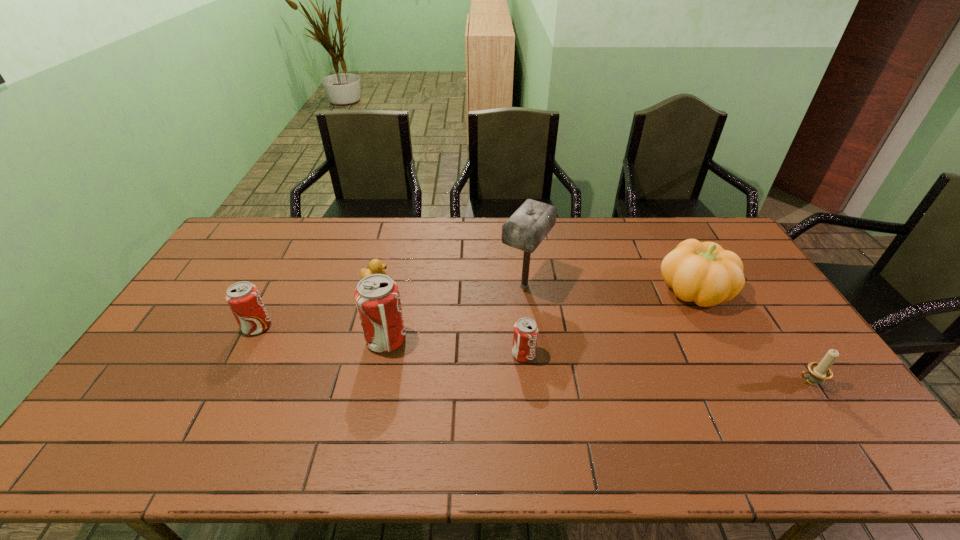
I want to click on the leftmost soda can, so click(243, 298).

You are a GUI agent. You are given a task and a screenshot of the screen. Output one action in this format:
    pyautogui.click(x=<x>, y=<y>)
    Task: Click on the second shortest soda can
    Image resolution: width=960 pixels, height=540 pixels.
    Given the screenshot: What is the action you would take?
    pyautogui.click(x=243, y=298)

Image resolution: width=960 pixels, height=540 pixels. I want to click on the second tallest object, so click(377, 297).

This screenshot has width=960, height=540. Find the location of `the tallest soda can`. the tallest soda can is located at coordinates (377, 297).

Identify the location of the shortest soda can. Image resolution: width=960 pixels, height=540 pixels. (525, 336).

This screenshot has width=960, height=540. What are the coordinates of `the second object from right to left` in the screenshot? It's located at (702, 272).

This screenshot has height=540, width=960. Find the location of `the tallest object`. the tallest object is located at coordinates (528, 226).

Where is `the shortest object`? The width and height of the screenshot is (960, 540). the shortest object is located at coordinates (375, 266).

The height and width of the screenshot is (540, 960). Identify the location of the nearest object. (818, 371).

At what (x,y) coordinates should I click in order to perform the action: click on candle_holder. Please return your answer as a coordinate pair (x, y). The image size is (960, 540). Looking at the image, I should click on [818, 371].